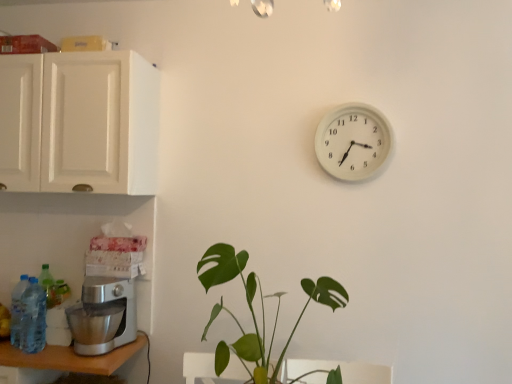
Question: Is there a large distance between translucent plastic bottle at lower left, the 1th bottle from the left, and silver metallic table at lower left?

Choices:
 (A) yes
 (B) no

Answer: (B)

Question: Can you confirm if translucent plastic bottle at lower left, positioned as the second bottle in right-to-left order, is wider than silver metallic table at lower left?

Choices:
 (A) no
 (B) yes

Answer: (A)

Question: From a real-world perspective, is translucent plastic bottle at lower left, the 1th bottle from the left, positioned over silver metallic table at lower left based on gravity?

Choices:
 (A) no
 (B) yes

Answer: (B)

Question: Could you tell me if translucent plastic bottle at lower left, positioned as the second bottle in right-to-left order, is turned towards silver metallic table at lower left?

Choices:
 (A) no
 (B) yes

Answer: (A)

Question: From a real-world perspective, is translucent plastic bottle at lower left, the 1th bottle from the left, located beneath silver metallic table at lower left?

Choices:
 (A) no
 (B) yes

Answer: (A)

Question: In the image, is silver metallic table at lower left positioned in front of or behind satin silver mixer at lower left?

Choices:
 (A) behind
 (B) front

Answer: (B)

Question: From a real-world perspective, is silver metallic table at lower left above or below satin silver mixer at lower left?

Choices:
 (A) below
 (B) above

Answer: (A)

Question: Looking at their shapes, would you say silver metallic table at lower left is wider or thinner than satin silver mixer at lower left?

Choices:
 (A) wide
 (B) thin

Answer: (A)

Question: Considering the relative positions of silver metallic table at lower left and satin silver mixer at lower left in the image provided, is silver metallic table at lower left to the left or to the right of satin silver mixer at lower left?

Choices:
 (A) left
 (B) right

Answer: (A)

Question: Is white plastic wall clock at upper right in front of or behind translucent plastic bottle at lower left, the 1th bottle from the left, in the image?

Choices:
 (A) front
 (B) behind

Answer: (B)

Question: Looking at the image, does white plastic wall clock at upper right seem bigger or smaller compared to translucent plastic bottle at lower left, the 1th bottle from the left?

Choices:
 (A) small
 (B) big

Answer: (B)

Question: From a real-world perspective, is white plastic wall clock at upper right positioned above or below translucent plastic bottle at lower left, positioned as the second bottle in right-to-left order?

Choices:
 (A) above
 (B) below

Answer: (A)

Question: Is white plastic wall clock at upper right situated inside translucent plastic bottle at lower left, positioned as the second bottle in right-to-left order, or outside?

Choices:
 (A) outside
 (B) inside

Answer: (A)

Question: Is silver metallic table at lower left spatially inside translucent plastic bottle at lower left, the 1th bottle from the left, or outside of it?

Choices:
 (A) inside
 (B) outside

Answer: (B)

Question: Is silver metallic table at lower left in front of or behind translucent plastic bottle at lower left, positioned as the second bottle in right-to-left order, in the image?

Choices:
 (A) behind
 (B) front

Answer: (B)